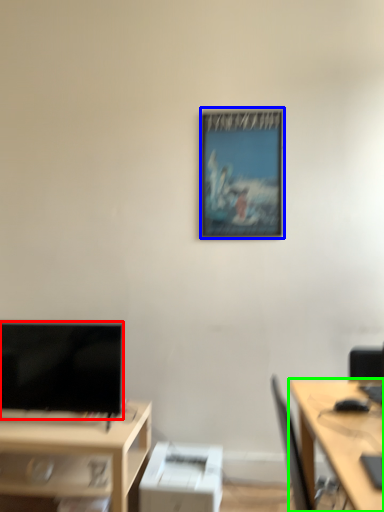
Question: Which object is positioned closest to television (highlighted by a red box)? Select from picture frame (highlighted by a blue box) and desk (highlighted by a green box).

Choices:
 (A) picture frame
 (B) desk

Answer: (A)